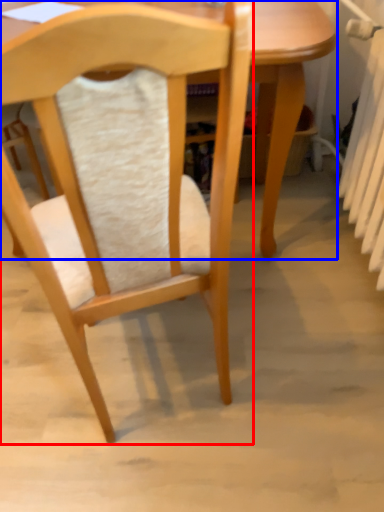
Question: Which object is further to the camera taking this photo, chair (highlighted by a red box) or table (highlighted by a blue box)?

Choices:
 (A) chair
 (B) table

Answer: (B)